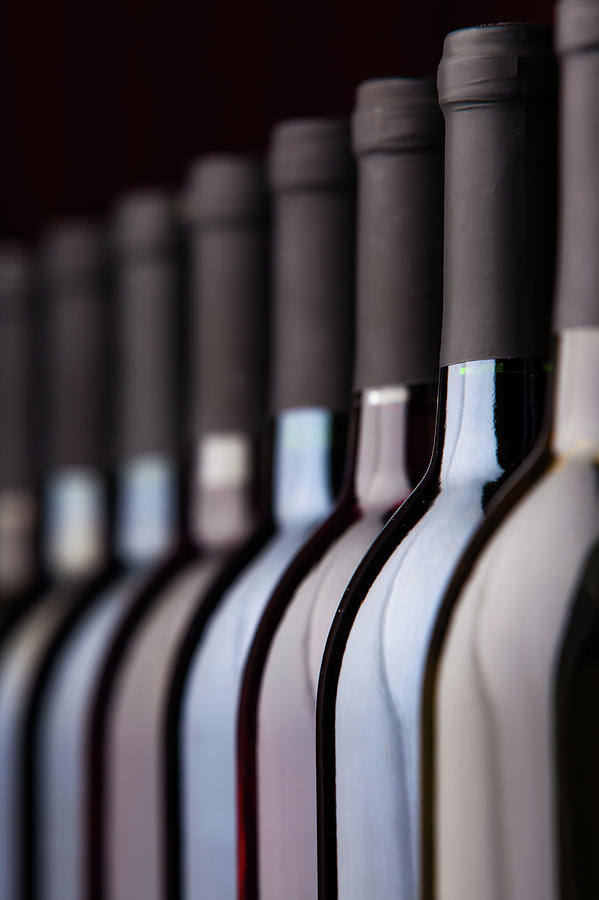
Find the location of a particular element. The image size is (599, 900). red wine bottles is located at coordinates (515, 670), (383, 679), (284, 693), (208, 702), (138, 712), (59, 717), (9, 669).